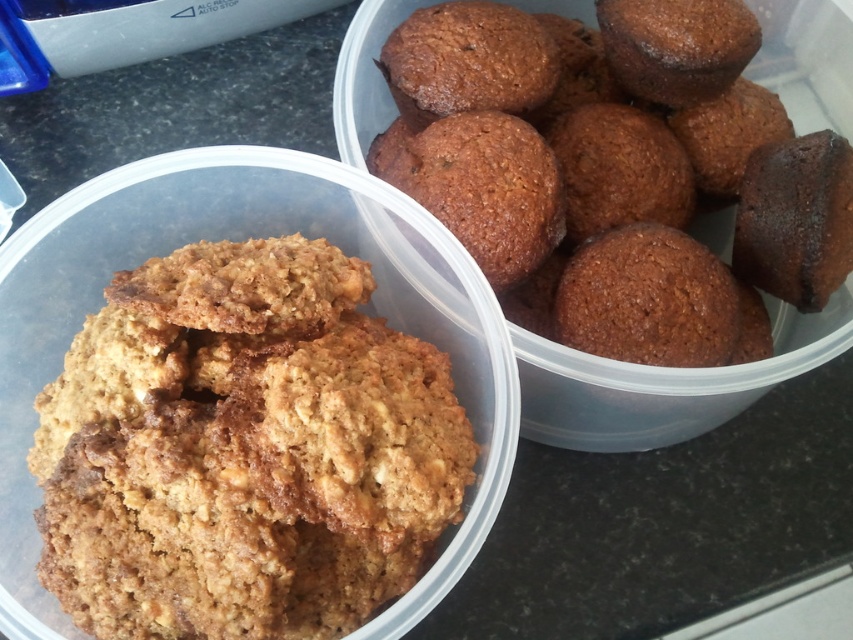
You are at a bakery counter and see the golden brown textured cookies at center and the brown matte muffin at upper right. If you want to choose the larger baked good, which one should you pick?

The brown matte muffin at upper right is larger than the golden brown textured cookies at center, so you should choose the brown matte muffin at upper right.

What is located at the point with coordinates (238,240) in the image?

The point at coordinates (238,240) is where the golden brown textured cookies at center are located.